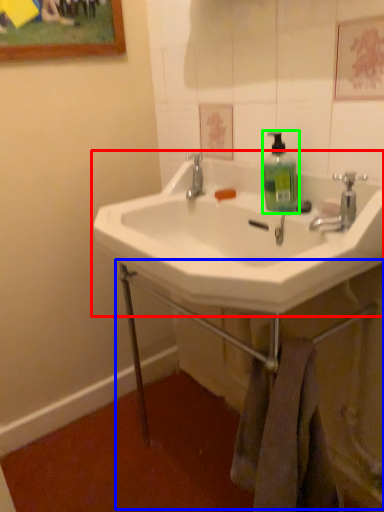
Question: Estimate the real-world distances between objects in this image. Which object is closer to sink (highlighted by a red box), counter (highlighted by a blue box) or soap dispenser (highlighted by a green box)?

Choices:
 (A) counter
 (B) soap dispenser

Answer: (B)